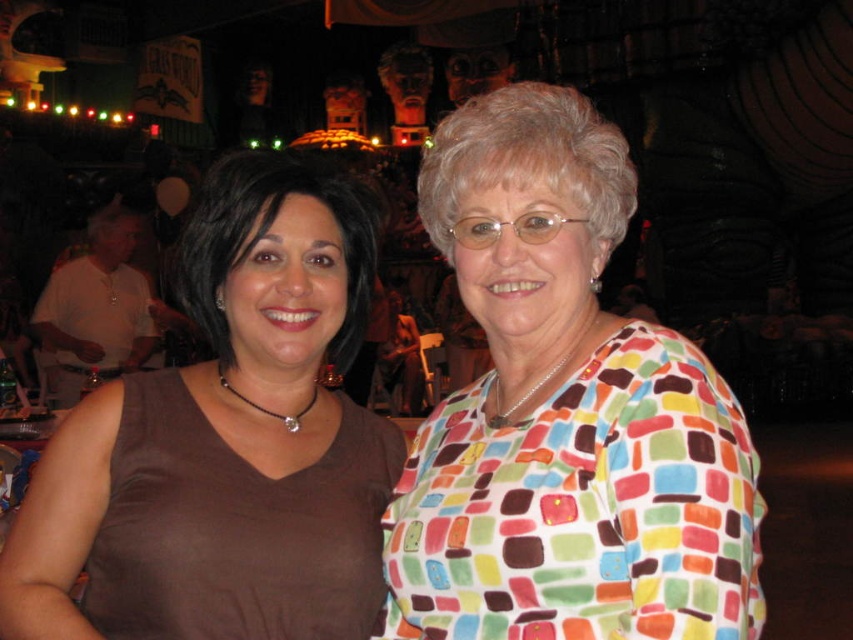
You are a photographer trying to capture the multicolored fabric blouse at center and the matte brown tank top at left. Which of these two items is closer to the camera?

The multicolored fabric blouse at center is closer to the camera because it is in front of the matte brown tank top at left.

You are a fashion designer observing the two women in the image. The multicolored fabric blouse at center and the matte brown tank top at left are both in your design collection. Based on their sizes, which one would require more fabric to create?

The multicolored fabric blouse at center is taller than the matte brown tank top at left, so it would require more fabric to create.